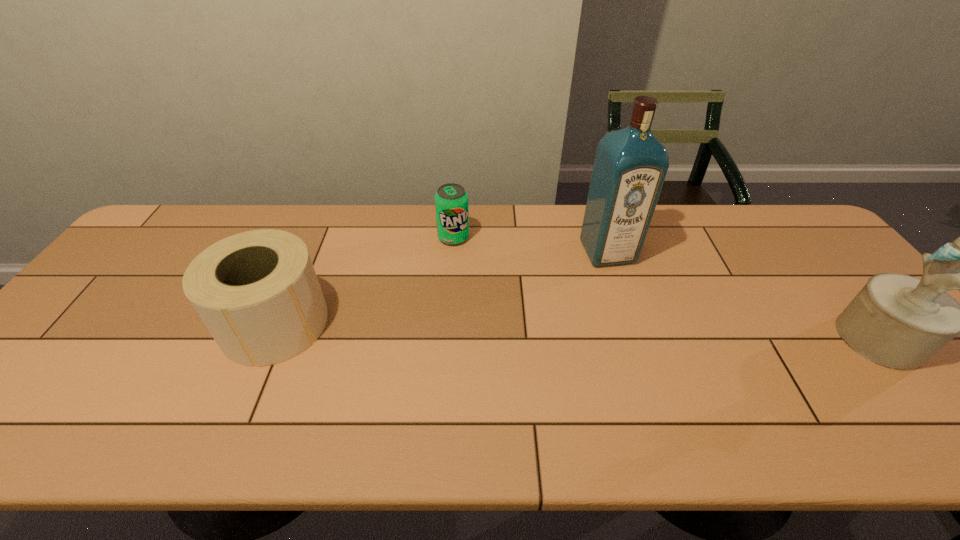
The image size is (960, 540). What are the coordinates of `vacant area that lies between the leftmost object and the pop soda` in the screenshot? It's located at (365, 280).

I want to click on free space between the second shortest object and the third object from left to right, so click(442, 288).

What are the coordinates of `unoccupied area between the third object from right to left and the leftmost object` in the screenshot? It's located at (365, 280).

Image resolution: width=960 pixels, height=540 pixels. In order to click on free area in between the liquor and the toilet tissue in this screenshot , I will do click(x=442, y=288).

Identify the location of free space between the tallest object and the leftmost object. Image resolution: width=960 pixels, height=540 pixels. (442, 288).

Point out which object is positioned as the second nearest to the tallest object. Please provide its 2D coordinates. Your answer should be formatted as a tuple, i.e. [(x, y)], where the tuple contains the x and y coordinates of a point satisfying the conditions above.

[(897, 321)]

Find the location of a particular element. the third closest object to the third object from right to left is located at coordinates (897, 321).

This screenshot has height=540, width=960. What are the coordinates of `blank area in the image that satisfies the following two spatial constraints: 1. on the back side of the toilet tissue; 2. on the right side of the tallest object` in the screenshot? It's located at (306, 252).

I want to click on free space that satisfies the following two spatial constraints: 1. on the front side of the figurine; 2. at the beak of the leftmost object, so click(x=269, y=339).

At what (x,y) coordinates should I click in order to perform the action: click on vacant space that satisfies the following two spatial constraints: 1. on the front side of the figurine; 2. at the beak of the second shortest object. Please return your answer as a coordinate pair (x, y). Looking at the image, I should click on (269, 339).